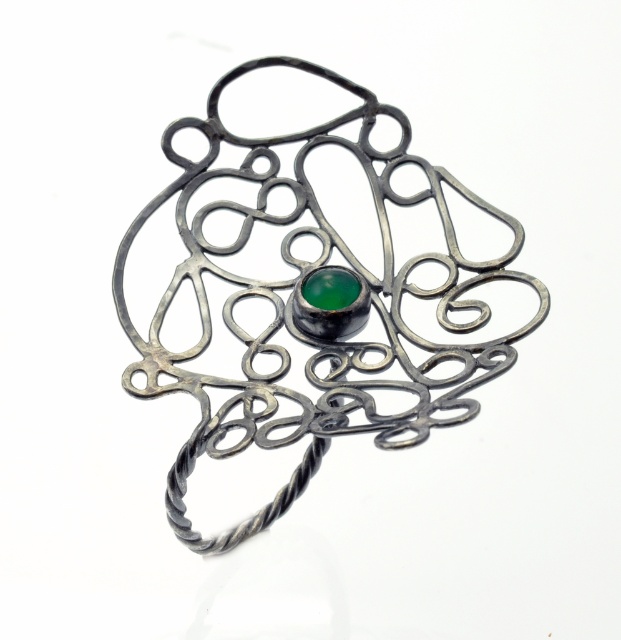
Does polished silver ring at center lie in front of green glass at center?

Yes, polished silver ring at center is in front of green glass at center.

Does polished silver ring at center appear on the right side of green glass at center?

Yes, polished silver ring at center is to the right of green glass at center.

Is point (435, 188) less distant than point (345, 300)?

No.

This screenshot has width=621, height=640. In order to click on polished silver ring at center in this screenshot , I will do `click(291, 307)`.